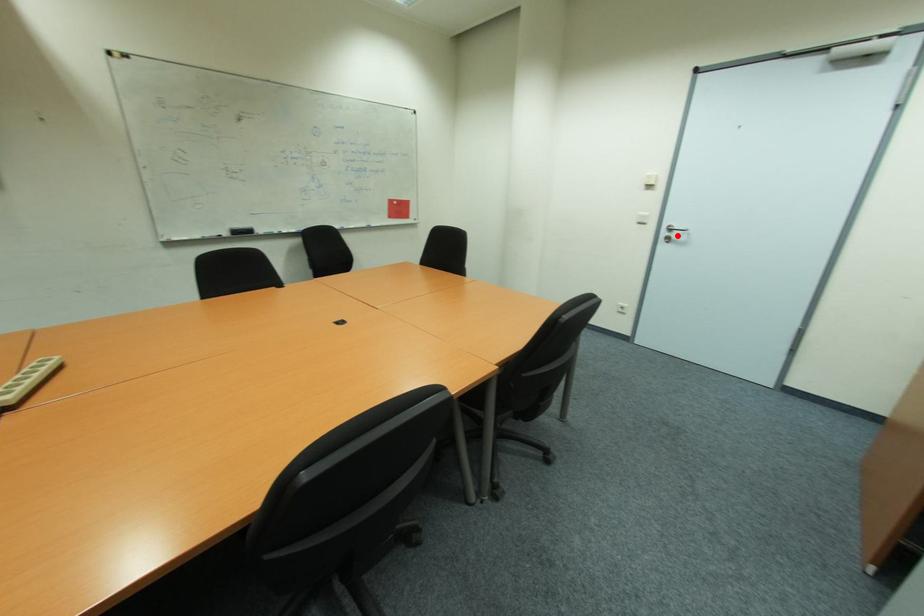
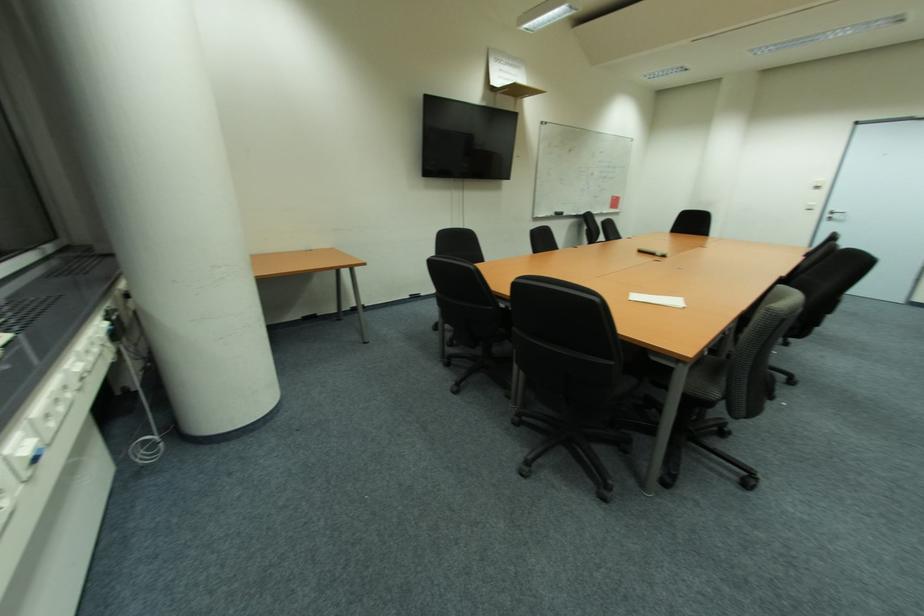
Question: I am providing you with two images of the same scene from different viewpoints. A red point is shown in image1. For the corresponding object point in image2, is it positioned nearer or farther from the camera?

Choices:
 (A) Nearer
 (B) Farther

Answer: (B)